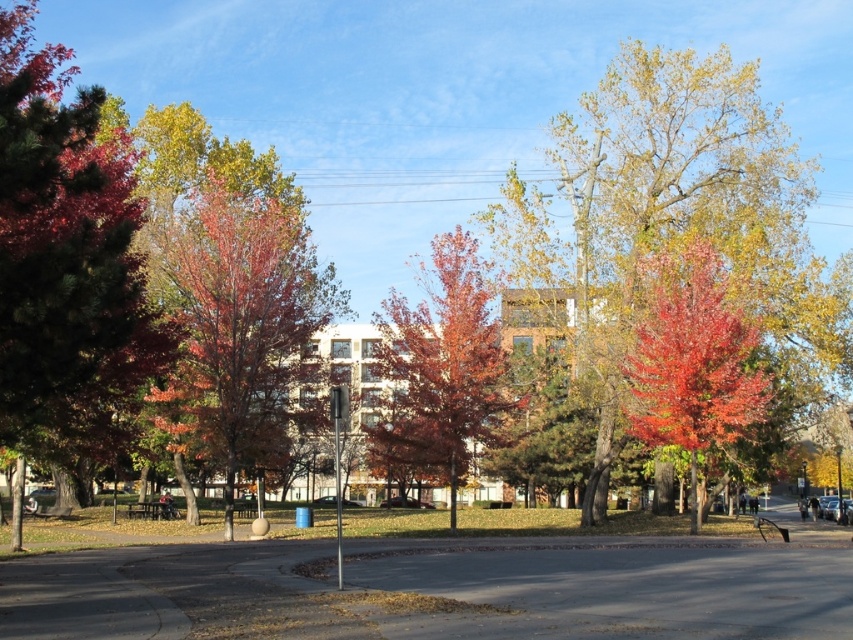
You are a gardener trying to determine which object has a greater width between the shiny red leaves at left and the matte red tree at center. Based on the scene, can you tell which one is wider?

The shiny red leaves at left might be wider than matte red tree at center according to the description.

You are standing at the center of the park and want to take a photo that includes both the point at coordinates point (39,260) and the point at coordinates point (468,360). Which point should you focus on first to ensure both are in focus?

You should focus on the point at coordinates point (39,260) first because it is closer to the camera than point (468,360), ensuring both points are within the depth of field.